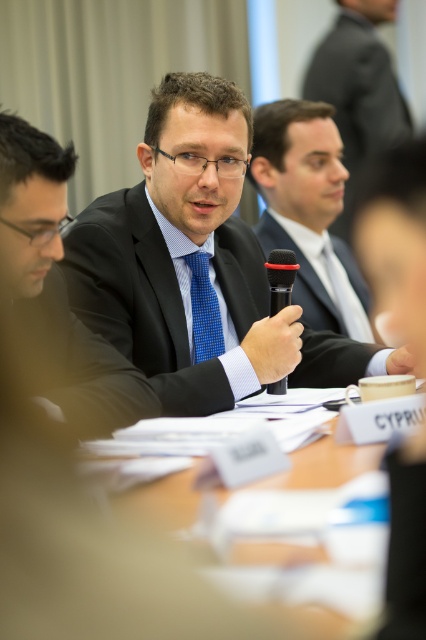
Which is more to the right, matte black microphone at center or blue checkered tie at center?

matte black microphone at center is more to the right.

Who is higher up, matte black microphone at center or blue checkered tie at center?

matte black microphone at center

The width and height of the screenshot is (426, 640). Describe the element at coordinates (307, 211) in the screenshot. I see `matte black microphone at center` at that location.

At what (x,y) coordinates should I click in order to perform the action: click on matte black microphone at center. Please return your answer as a coordinate pair (x, y). The height and width of the screenshot is (640, 426). Looking at the image, I should click on (307, 211).

How distant is matte black microphone at center from wooden table at center?

The distance of matte black microphone at center from wooden table at center is 1.16 meters.

Is matte black microphone at center above wooden table at center?

Indeed, matte black microphone at center is positioned over wooden table at center.

Between point (264, 252) and point (135, 442), which one is positioned in front?

Positioned in front is point (135, 442).

Where is `matte black microphone at center`? The width and height of the screenshot is (426, 640). matte black microphone at center is located at coordinates point(307,211).

Is dark gray suit at upper right below blue checkered tie at center?

No, dark gray suit at upper right is not below blue checkered tie at center.

Which is behind, point (362, 112) or point (196, 253)?

The point (362, 112) is behind.

I want to click on dark gray suit at upper right, so click(359, 90).